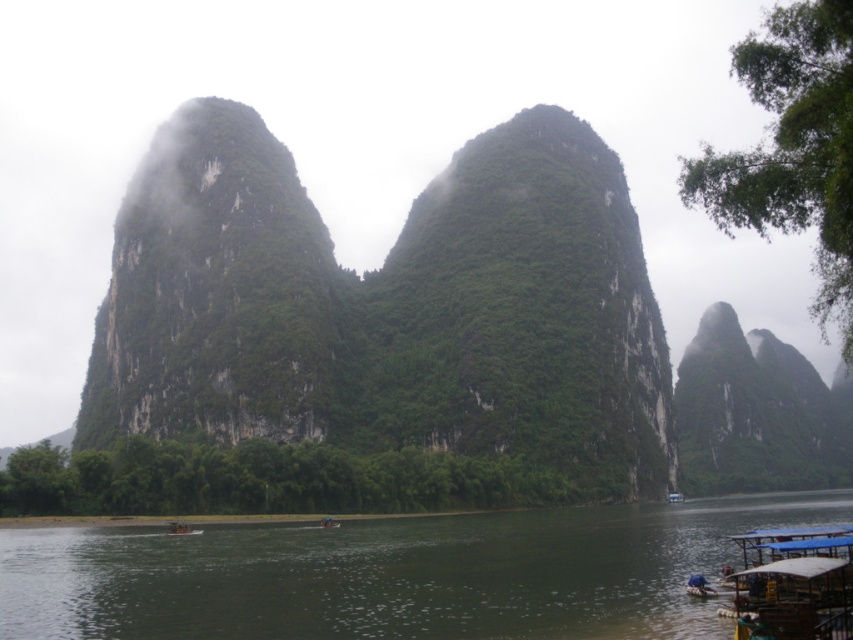
Question: Which object is positioned closest to the green textured rock at right?

Choices:
 (A) green rock formation at center
 (B) dark green water at center

Answer: (A)

Question: Is dark green water at center smaller than wooden boat at center?

Choices:
 (A) yes
 (B) no

Answer: (B)

Question: Among these points, which one is nearest to the camera?

Choices:
 (A) (329, 522)
 (B) (183, 532)

Answer: (B)

Question: Which point is farther to the camera?

Choices:
 (A) wooden boat at lower center
 (B) green textured rock at right
 (C) wooden boat at center
 (D) green rock formation at center

Answer: (B)

Question: Is the position of green textured rock at right more distant than that of wooden boat at lower center?

Choices:
 (A) no
 (B) yes

Answer: (B)

Question: Where is green textured rock at right located in relation to wooden boat at center in the image?

Choices:
 (A) right
 (B) left

Answer: (A)